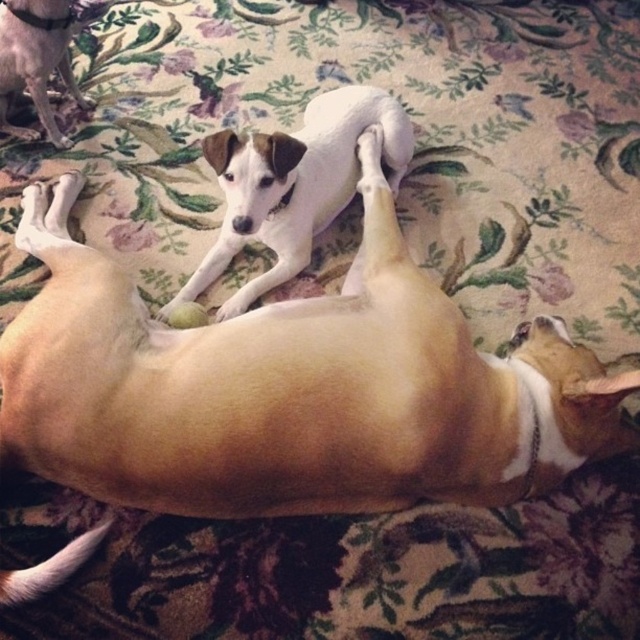
Does point (432, 371) come behind point (385, 156)?

No, it is in front of (385, 156).

From the picture: Can you confirm if light brown fur at center is positioned below white smooth dog at center?

Yes.

Is point (349, 342) behind point (276, 232)?

No, (349, 342) is in front of (276, 232).

Where is `light brown fur at center`? This screenshot has height=640, width=640. light brown fur at center is located at coordinates (291, 387).

Which is above, light brown fur at center or white fur dog at upper left?

white fur dog at upper left is higher up.

Which of these two, light brown fur at center or white fur dog at upper left, stands shorter?

white fur dog at upper left

Image resolution: width=640 pixels, height=640 pixels. Identify the location of light brown fur at center. (291, 387).

Is point (266, 243) positioned after point (8, 99)?

No, (266, 243) is in front of (8, 99).

Who is more forward, (260, 202) or (36, 10)?

Positioned in front is point (260, 202).

Where is `white smooth dog at center`? This screenshot has width=640, height=640. white smooth dog at center is located at coordinates (292, 186).